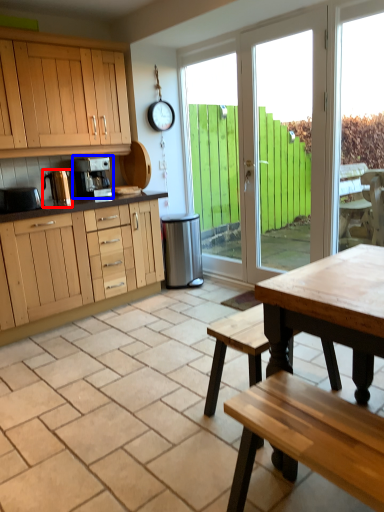
Question: Which of the following is the farthest to the observer, appliance (highlighted by a red box) or coffee maker (highlighted by a blue box)?

Choices:
 (A) appliance
 (B) coffee maker

Answer: (B)